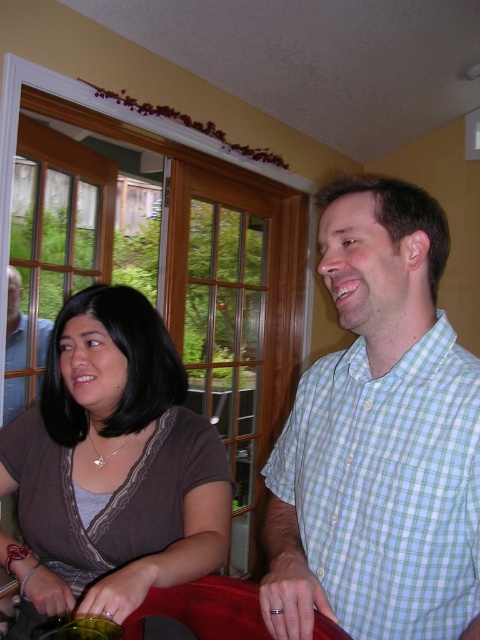
Consider the image. You are a delivery robot that needs to place a package between the green checkered shirt at upper right and the matte black laptop at left. The package requires 5 feet of space. Can you fit it there?

The distance between the green checkered shirt at upper right and the matte black laptop at left is 4.67 feet, which is less than the required 5 feet. Therefore, the package cannot fit in that space.

You are organizing a photo album and want to place the image correctly based on spatial relationships. Which object is positioned to the right of the other between the green checkered shirt at center and the matte black laptop at left?

The green checkered shirt at center is positioned to the right of the matte black laptop at left according to the description.

You are organizing a small table in the scene and need to place both the matte brown blouse at center and the matte black laptop at left on it. Given their sizes, which object should you place first to ensure they both fit comfortably?

The matte brown blouse at center is bigger than the matte black laptop at left, so you should place the matte brown blouse at center first to accommodate its larger size before placing the matte black laptop at left.